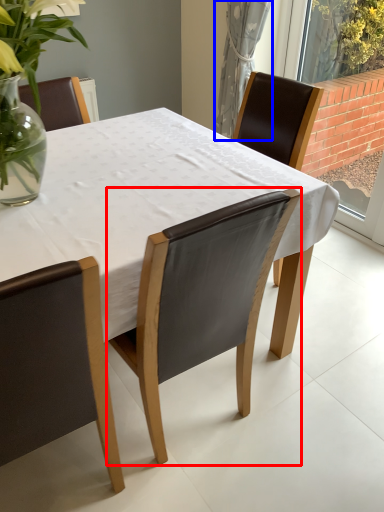
Question: Which point is closer to the camera, chair (highlighted by a red box) or curtain (highlighted by a blue box)?

Choices:
 (A) chair
 (B) curtain

Answer: (A)